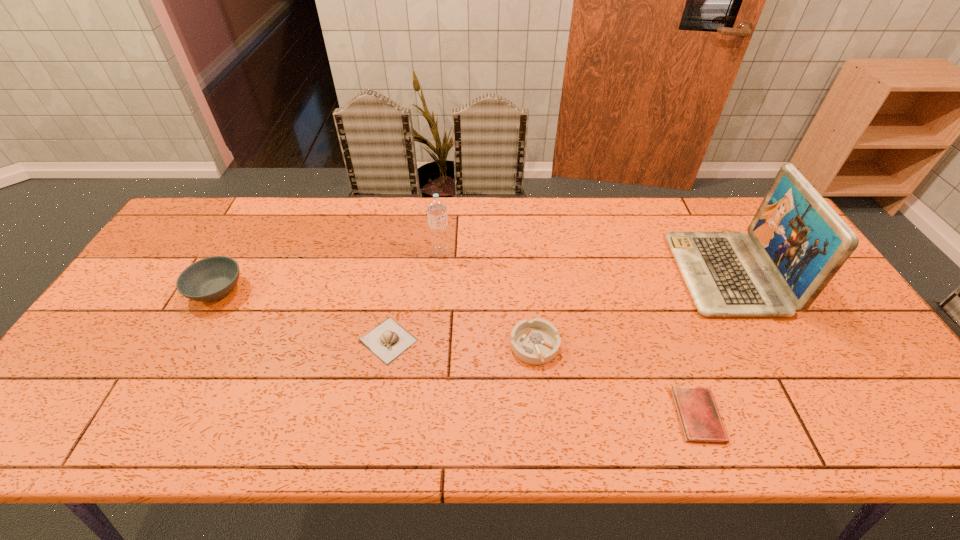
Where is `diary`? diary is located at coordinates (699, 417).

What are the coordinates of `the shortest object` in the screenshot? It's located at (699, 417).

At what (x,y) coordinates should I click in order to perform the action: click on vacant region located on the screen of the tallest object. Please return your answer as a coordinate pair (x, y). Looking at the image, I should click on (543, 273).

Identify the location of free space located on the screen of the tallest object. The width and height of the screenshot is (960, 540). (564, 273).

I want to click on vacant area situated 0.160m on the screen of the tallest object, so click(x=625, y=273).

At what (x,y) coordinates should I click in order to perform the action: click on vacant space situated 0.320m on the right of the water bottle. Please return your answer as a coordinate pair (x, y). Looking at the image, I should click on (554, 252).

Identify the location of vacant space located 0.300m on the front of the soup bowl. (147, 415).

Locate an element on the screen. vacant space situated on the back of the ashtray is located at coordinates (527, 274).

Where is `free space located on the front of the second object from left to right`? free space located on the front of the second object from left to right is located at coordinates (372, 433).

This screenshot has height=540, width=960. What are the coordinates of `free region located 0.360m on the right of the diary` in the screenshot? It's located at (879, 415).